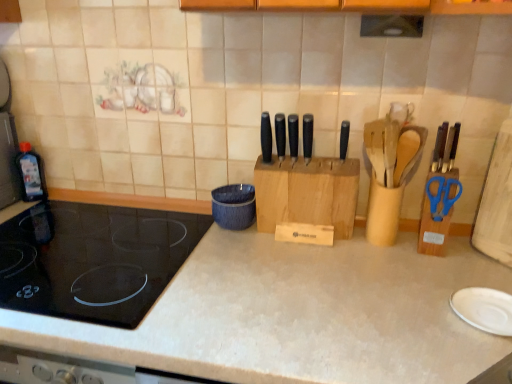
Question: Is blue textured bowl at center wider than black glass cooktop at left?

Choices:
 (A) yes
 (B) no

Answer: (B)

Question: Is blue textured bowl at center directly adjacent to black glass cooktop at left?

Choices:
 (A) yes
 (B) no

Answer: (B)

Question: From a real-world perspective, is blue textured bowl at center positioned over black glass cooktop at left based on gravity?

Choices:
 (A) no
 (B) yes

Answer: (B)

Question: From the image's perspective, is blue textured bowl at center beneath black glass cooktop at left?

Choices:
 (A) yes
 (B) no

Answer: (B)

Question: From a real-world perspective, is blue textured bowl at center physically below black glass cooktop at left?

Choices:
 (A) no
 (B) yes

Answer: (A)

Question: Could you tell me if blue textured bowl at center is turned towards black glass cooktop at left?

Choices:
 (A) yes
 (B) no

Answer: (B)

Question: Is black glass cooktop at left behind black matte knife at center, the third knife positioned from the left?

Choices:
 (A) no
 (B) yes

Answer: (A)

Question: Does black glass cooktop at left appear on the right side of black matte knife at center, the third knife positioned from the left?

Choices:
 (A) yes
 (B) no

Answer: (B)

Question: From a real-world perspective, does black glass cooktop at left stand above black matte knife at center, which is the third knife from right to left?

Choices:
 (A) no
 (B) yes

Answer: (A)

Question: Considering the relative sizes of black glass cooktop at left and black matte knife at center, the third knife positioned from the left, in the image provided, is black glass cooktop at left shorter than black matte knife at center, the third knife positioned from the left,?

Choices:
 (A) yes
 (B) no

Answer: (A)

Question: Does black glass cooktop at left have a lesser width compared to black matte knife at center, which is the third knife from right to left?

Choices:
 (A) no
 (B) yes

Answer: (A)

Question: Is black glass cooktop at left located outside black matte knife at center, which is the third knife from right to left?

Choices:
 (A) no
 (B) yes

Answer: (B)

Question: Does black matte knife at center, which appears as the second knife when viewed from the right, come behind black matte knife at center, arranged as the first knife when viewed from the left?

Choices:
 (A) yes
 (B) no

Answer: (B)